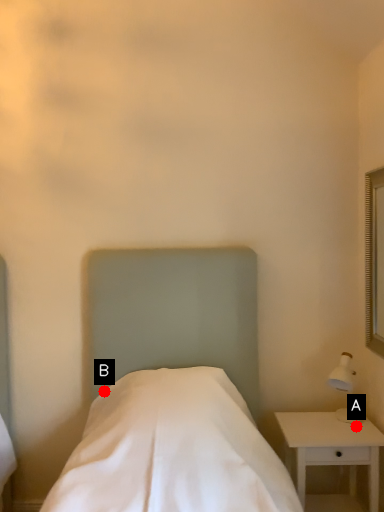
Question: Two points are circled on the image, labeled by A and B beside each circle. Among these points, which one is farthest from the camera?

Choices:
 (A) A is further
 (B) B is further

Answer: (B)